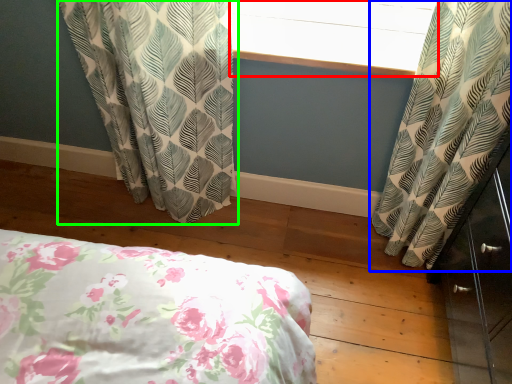
Question: Based on their relative distances, which object is nearer to window screen (highlighted by a red box)? Choose from curtain (highlighted by a blue box) and curtain (highlighted by a green box).

Choices:
 (A) curtain
 (B) curtain

Answer: (A)